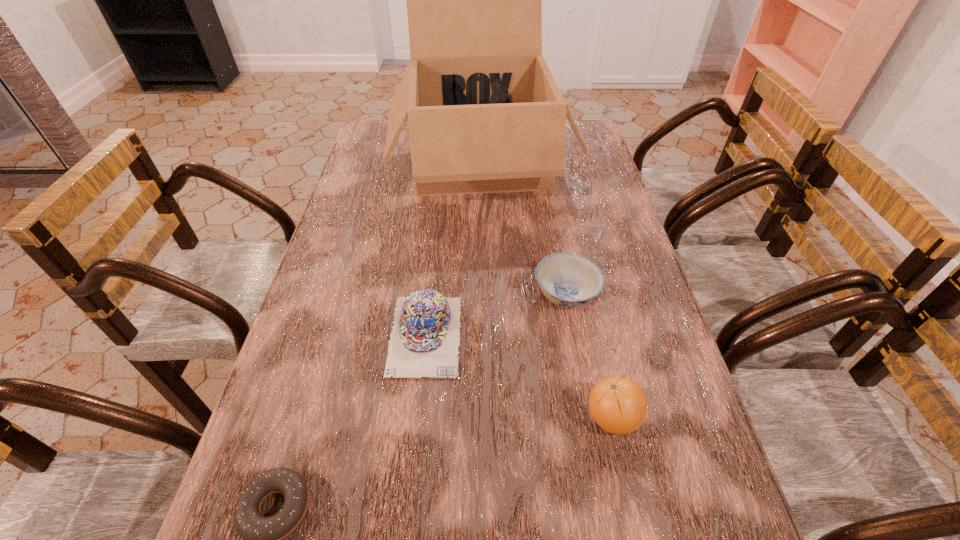
Identify the location of the tallest object. This screenshot has height=540, width=960. (485, 115).

Identify the location of box. Image resolution: width=960 pixels, height=540 pixels. (485, 115).

Locate an element on the screen. This screenshot has width=960, height=540. orange is located at coordinates (618, 405).

Locate an element on the screen. This screenshot has height=540, width=960. the second nearest object is located at coordinates (618, 405).

In order to click on cap in this screenshot , I will do `click(424, 342)`.

Locate an element on the screen. The image size is (960, 540). bowl is located at coordinates (568, 280).

Where is `vacant space located on the front of the farthest object`? This screenshot has height=540, width=960. vacant space located on the front of the farthest object is located at coordinates (481, 274).

The image size is (960, 540). I want to click on free region located 0.180m on the back of the fourth farthest object, so click(591, 322).

The height and width of the screenshot is (540, 960). I want to click on free space located 0.180m on the front, side, and top of the cap, so click(411, 470).

I want to click on free space located 0.270m on the back of the bowl, so click(550, 205).